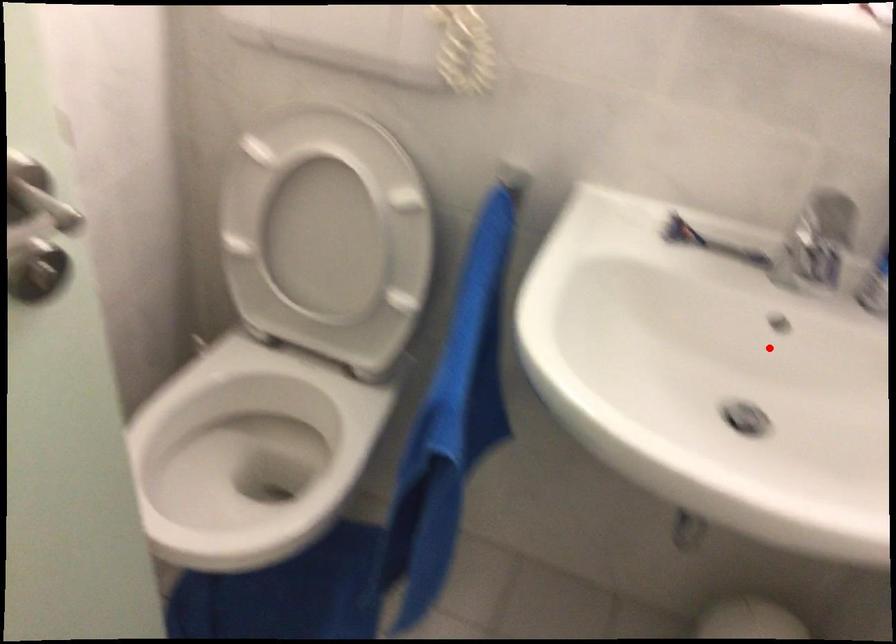
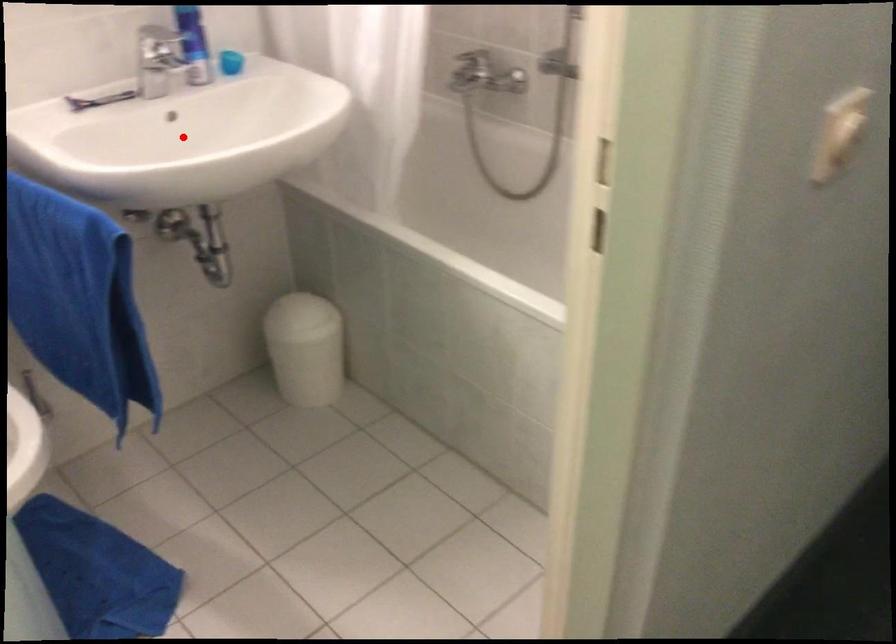
I am providing you with two images of the same scene from different viewpoints. A red point is marked on the first image and another point is marked on the second image. Is the red point in image1 aligned with the point shown in image2?

Yes